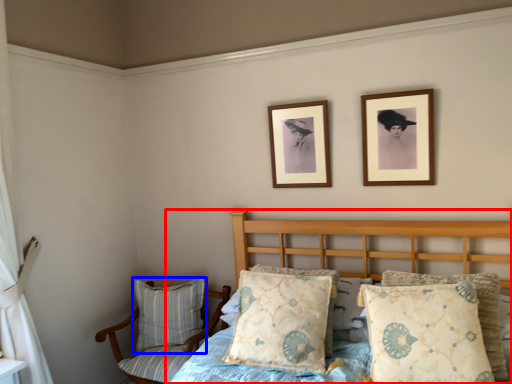
Question: Which object is further to the camera taking this photo, bed (highlighted by a red box) or pillow (highlighted by a blue box)?

Choices:
 (A) bed
 (B) pillow

Answer: (B)